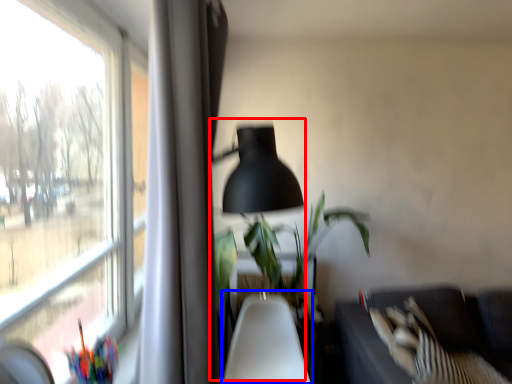
Question: Which point is closer to the camera, table lamp (highlighted by a red box) or swivel chair (highlighted by a blue box)?

Choices:
 (A) table lamp
 (B) swivel chair

Answer: (A)